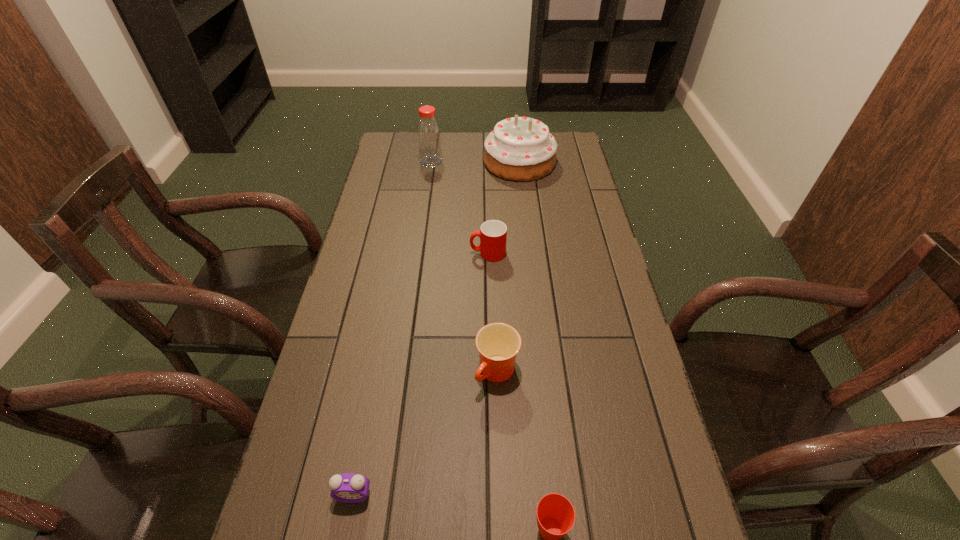
Find the location of a particular element. This screenshot has height=540, width=960. bottle is located at coordinates (428, 130).

Where is `cake`? This screenshot has width=960, height=540. cake is located at coordinates (519, 148).

Identify the location of the third nearest object. Image resolution: width=960 pixels, height=540 pixels. (498, 344).

I want to click on the farthest cup, so click(x=493, y=233).

Find the location of `the second nearest object`. the second nearest object is located at coordinates (350, 488).

Find the location of a particular element. the shortest object is located at coordinates (350, 488).

I want to click on vacant region located 0.150m on the right of the bottle, so click(479, 161).

Image resolution: width=960 pixels, height=540 pixels. Identify the location of vacant space situated 0.140m on the front of the cake. (524, 205).

The height and width of the screenshot is (540, 960). What are the coordinates of `free location located 0.120m on the back of the fourth farthest object` in the screenshot? It's located at (495, 315).

Find the location of a particular element. The height and width of the screenshot is (540, 960). free region located on the side of the fourth nearest object with the handle is located at coordinates (451, 253).